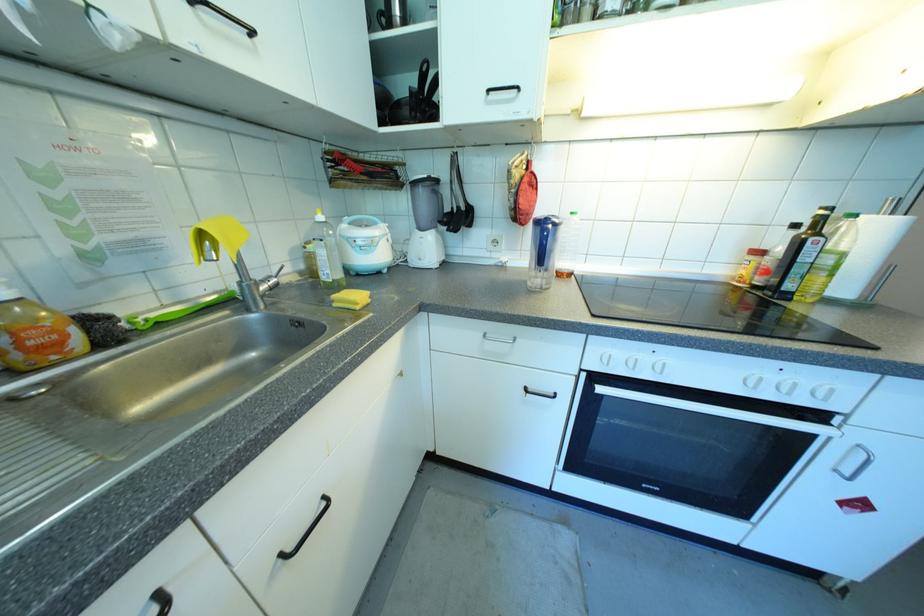
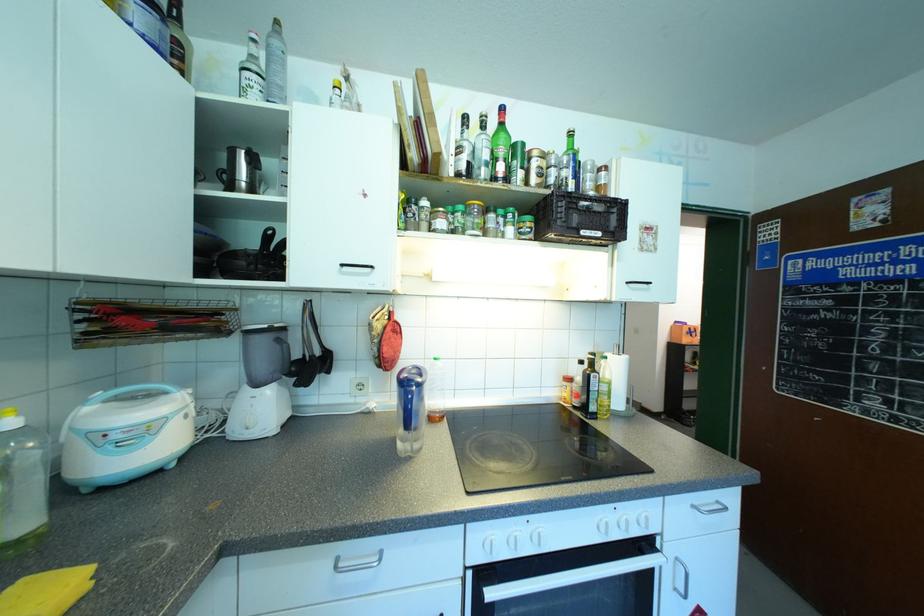
The point at [658,369] is marked in the first image. Where is the corresponding point in the second image?

(535, 540)